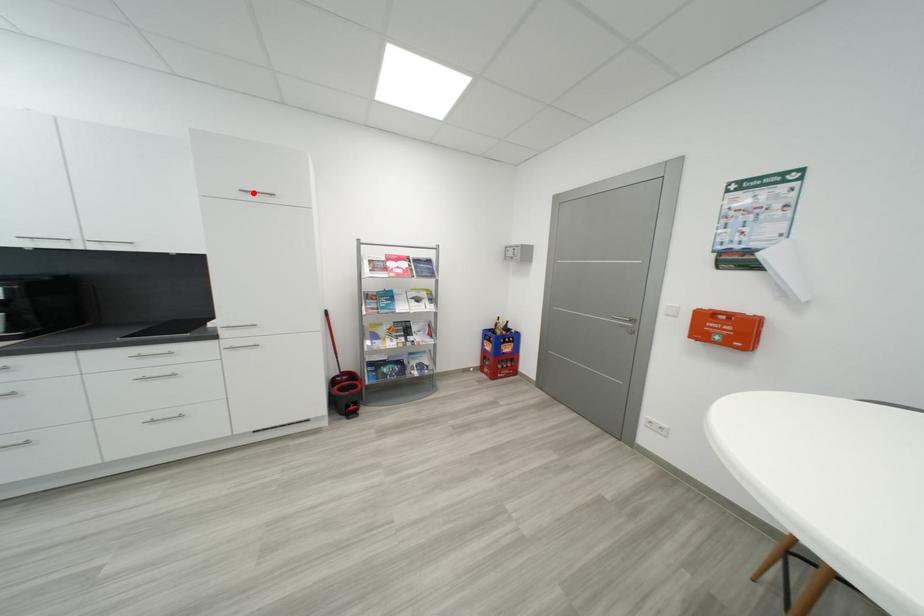
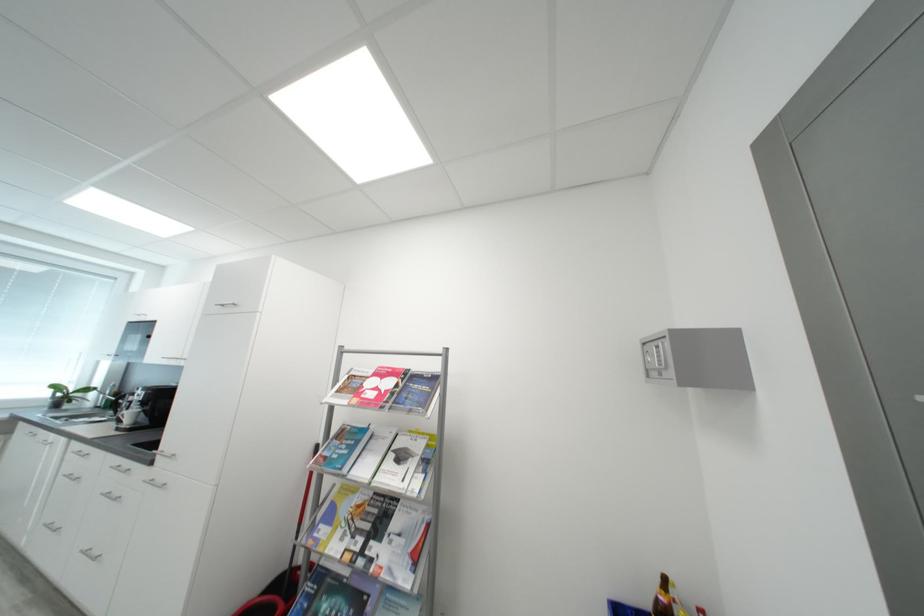
Where in the second image is the point corresponding to the highlighted location from the first image?

(228, 307)